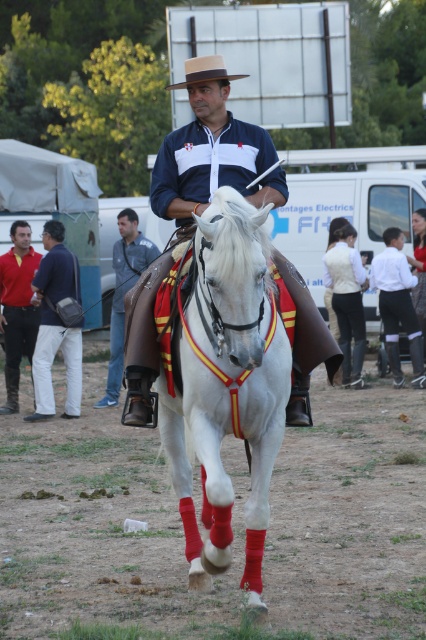
Which is behind, point (408, 545) or point (201, 72)?

Point (408, 545)

Between dirt field at center and natural straw cowboy hat at center, which one appears on the right side from the viewer's perspective?

dirt field at center

Who is more distant from viewer, (39, 632) or (170, 88)?

Positioned behind is point (170, 88).

At what (x,y) coordinates should I click in order to perform the action: click on dirt field at center. Please return your answer as a coordinate pair (x, y). Image resolution: width=426 pixels, height=640 pixels. Looking at the image, I should click on (101, 529).

From the picture: Can you confirm if white glossy horse at center is shorter than red shirt at left?

Indeed, white glossy horse at center has a lesser height compared to red shirt at left.

Between white glossy horse at center and red shirt at left, which one appears on the right side from the viewer's perspective?

From the viewer's perspective, white glossy horse at center appears more on the right side.

Who is more distant from viewer, [218,301] or [25,273]?

Point [25,273]

Identify the location of white glossy horse at center. (227, 385).

Can you confirm if matte gray bag at lower left is bigger than natural straw cowboy hat at center?

No, matte gray bag at lower left is not bigger than natural straw cowboy hat at center.

Does matte gray bag at lower left appear on the left side of natural straw cowboy hat at center?

Correct, you'll find matte gray bag at lower left to the left of natural straw cowboy hat at center.

Identify the location of matte gray bag at lower left. (55, 326).